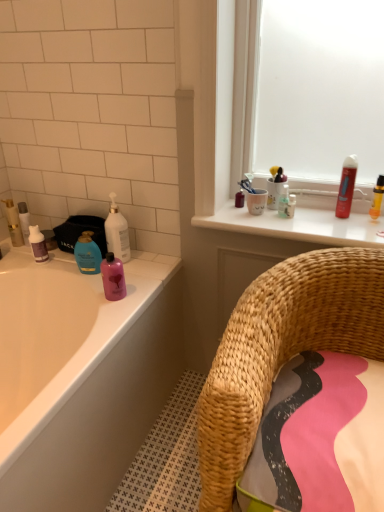
In order to click on free spot in front of matte white tube at left, marked as the 5th toiletry in a right-to-left arrangement in this screenshot , I will do `click(25, 253)`.